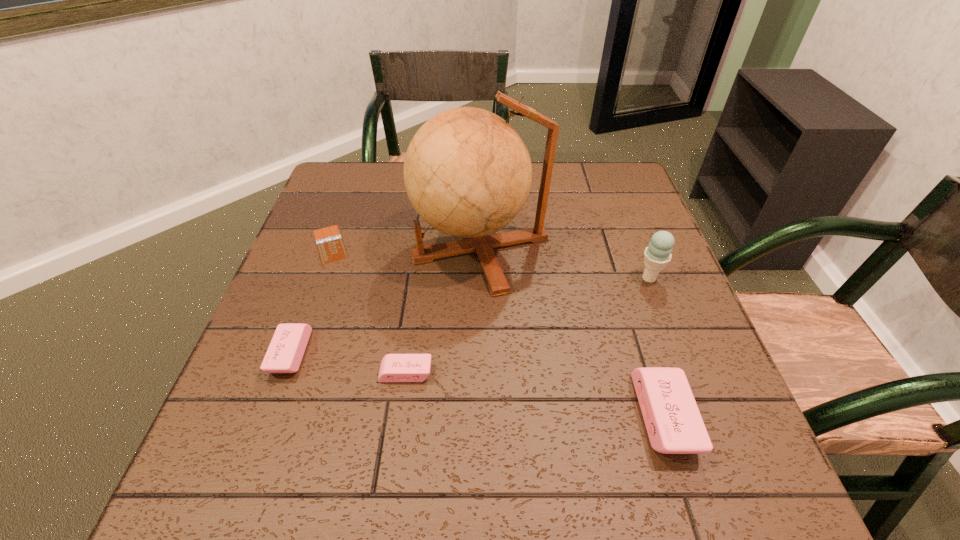
Image resolution: width=960 pixels, height=540 pixels. Identify the location of the leftmost eraser. click(285, 352).

Locate an element on the screen. This screenshot has width=960, height=540. the second shortest eraser is located at coordinates (285, 352).

Image resolution: width=960 pixels, height=540 pixels. Identify the location of the second eraser from right to left. (394, 367).

Where is `the shortest eraser`? The width and height of the screenshot is (960, 540). the shortest eraser is located at coordinates (394, 367).

Where is `the tallest eraser`? The width and height of the screenshot is (960, 540). the tallest eraser is located at coordinates (674, 424).

The width and height of the screenshot is (960, 540). I want to click on the rightmost eraser, so click(x=674, y=424).

Locate an element on the screen. This screenshot has height=540, width=960. ice cream is located at coordinates (657, 255).

Identify the location of the tallest object. (467, 173).

Image resolution: width=960 pixels, height=540 pixels. Find the location of `the shortest object`. the shortest object is located at coordinates (330, 245).

This screenshot has width=960, height=540. Find the location of `vacant space located 0.070m on the front of the fourth tallest object`. vacant space located 0.070m on the front of the fourth tallest object is located at coordinates (268, 415).